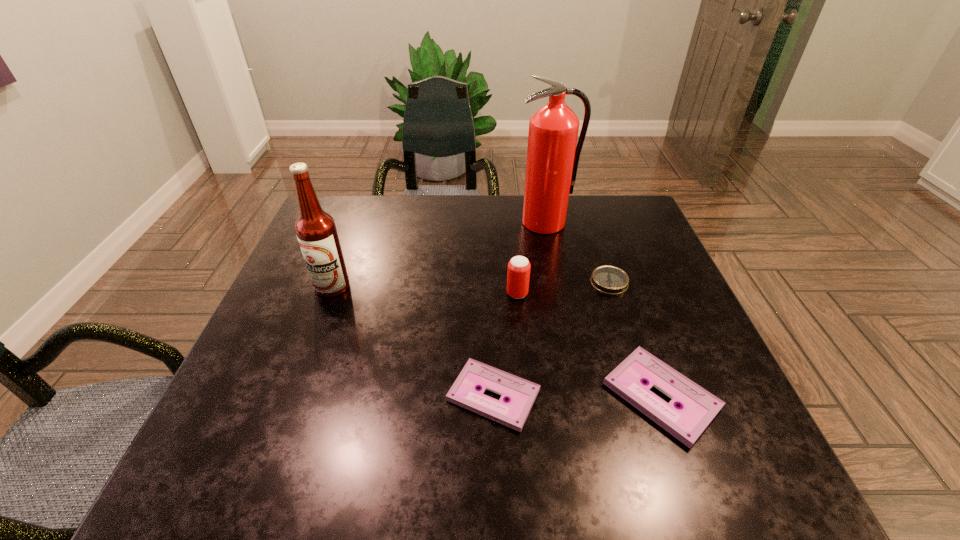
In the image, there is a desktop. At what (x,y) coordinates should I click in order to perform the action: click on vacant area at the near edge. Please return your answer as a coordinate pair (x, y). Looking at the image, I should click on (449, 408).

The image size is (960, 540). Identify the location of free space at the left edge of the desktop. 278,311.

The image size is (960, 540). In the image, there is a desktop. Identify the location of vacant space at the right edge. (647, 244).

Identify the location of free space at the far left corner. (343, 218).

You are a GUI agent. You are given a task and a screenshot of the screen. Output one action in this format:
    pyautogui.click(x=<x>, y=<y>)
    Task: Click on the vacant space at the far right corner
    The image size is (960, 540).
    Given the screenshot: What is the action you would take?
    pyautogui.click(x=605, y=219)

At what (x,y) coordinates should I click in order to perform the action: click on free space at the near right corner. Please return your answer as a coordinate pair (x, y). The height and width of the screenshot is (540, 960). Looking at the image, I should click on (742, 422).

The width and height of the screenshot is (960, 540). Identify the location of vacant space that's between the compass and the leftmost object. (470, 285).

At what (x,y) coordinates should I click in order to perform the action: click on free spot between the tallest object and the second tallest object. Please return your answer as a coordinate pair (x, y). The image size is (960, 540). Looking at the image, I should click on (439, 255).

Image resolution: width=960 pixels, height=540 pixels. What are the coordinates of `vacant area that lies between the leftmost object and the right videotape` in the screenshot? It's located at (496, 341).

Find the location of a particular element. The image size is (960, 540). free area in between the fourth shortest object and the leftmost object is located at coordinates (424, 290).